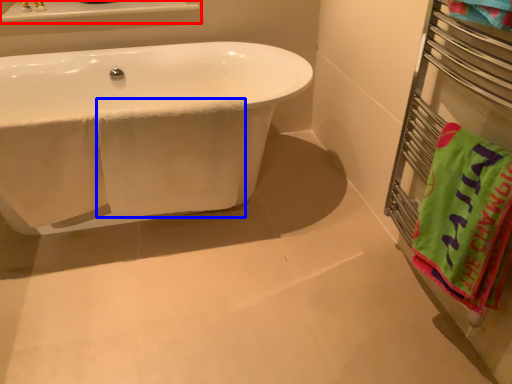
Question: Which point is further to the camera, window sill (highlighted by a red box) or bath towel (highlighted by a blue box)?

Choices:
 (A) window sill
 (B) bath towel

Answer: (A)